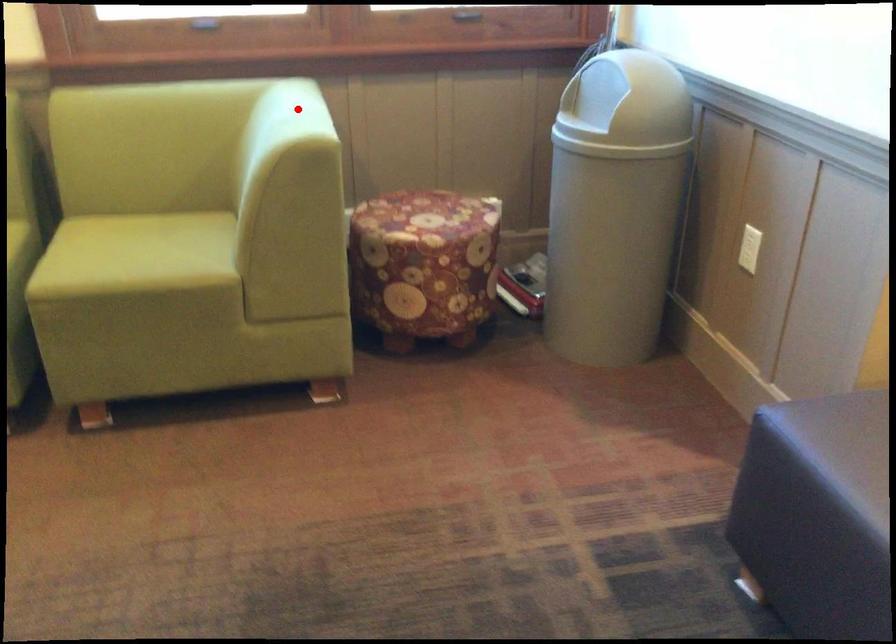
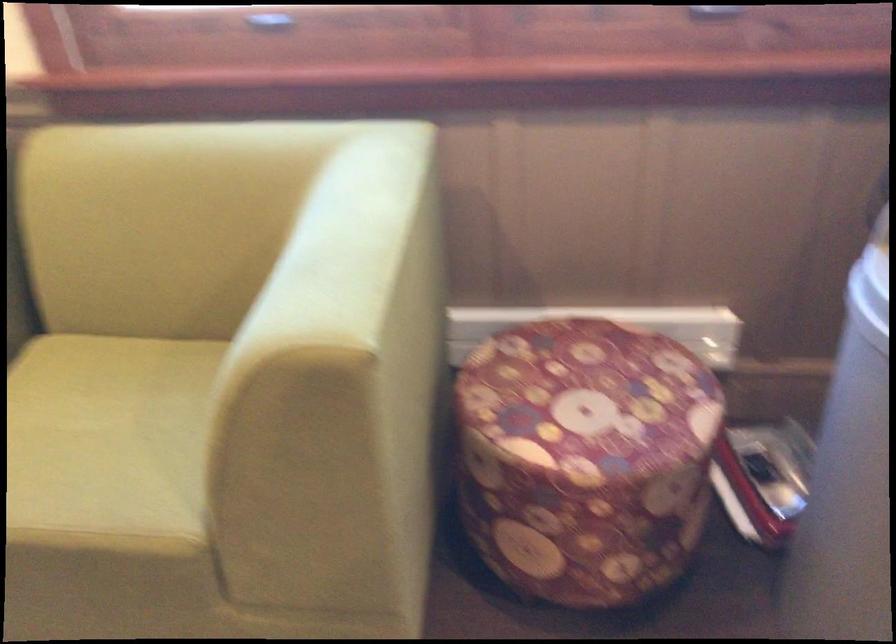
Locate, in the second image, the point that corresponds to the highlighted location in the first image.

(358, 223)